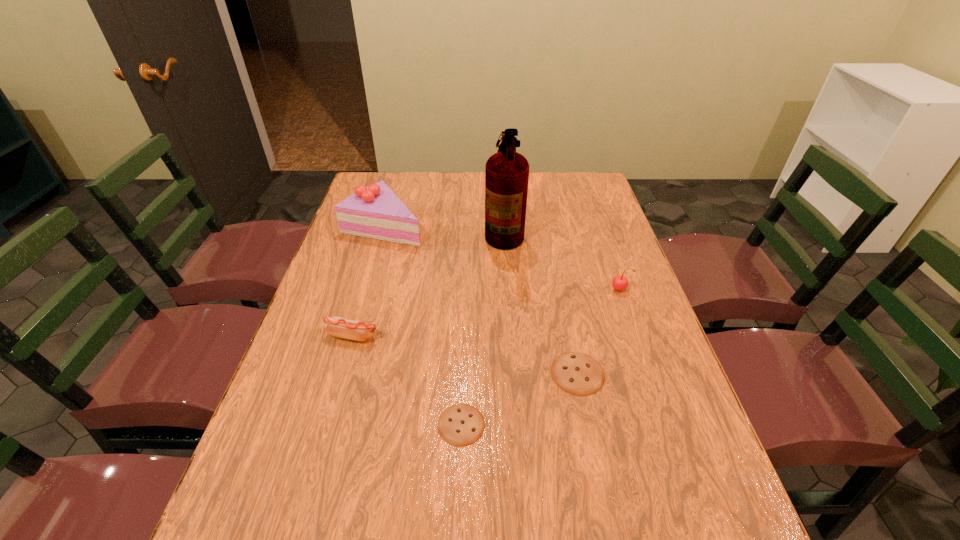
The image size is (960, 540). I want to click on the fourth object from right to left, so click(461, 424).

The width and height of the screenshot is (960, 540). Find the location of `the shortest object`. the shortest object is located at coordinates (461, 424).

Image resolution: width=960 pixels, height=540 pixels. I want to click on the second nearest object, so click(x=579, y=374).

Image resolution: width=960 pixels, height=540 pixels. I want to click on the fifth object from left to right, so click(x=579, y=374).

The image size is (960, 540). Find the location of `the tallest object`. the tallest object is located at coordinates (506, 172).

What are the coordinates of `fire extinguisher` in the screenshot? It's located at (506, 172).

Identify the location of cake. (376, 212).

Locate an element on the screen. The image size is (960, 540). sausage is located at coordinates (337, 326).

Identify the location of the fourth tallest object. The height and width of the screenshot is (540, 960). (337, 326).

The height and width of the screenshot is (540, 960). What are the coordinates of `the rightmost object` in the screenshot? It's located at (620, 282).